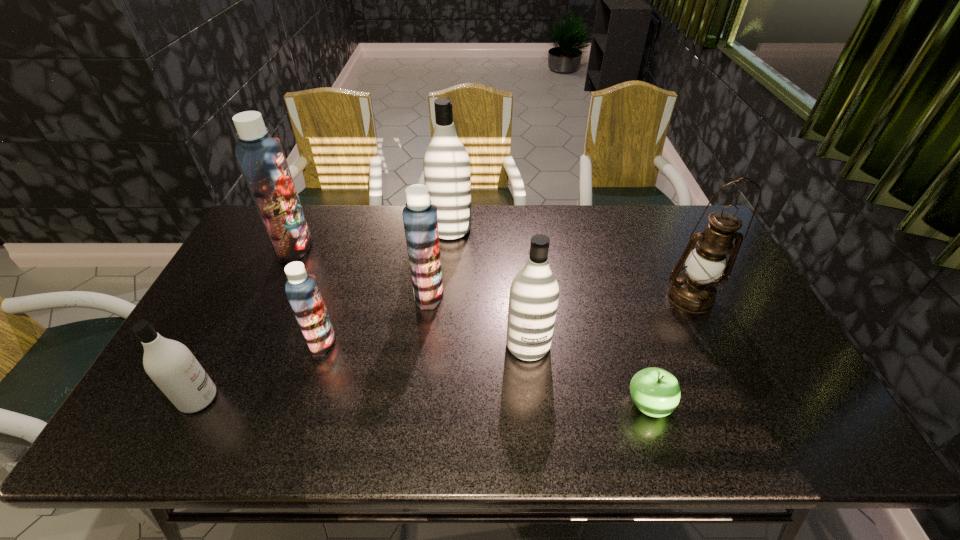
At what (x,y) coordinates should I click in order to perform the action: click on the smallest blue shampoo. Please return your answer as a coordinate pair (x, y). This screenshot has height=540, width=960. Looking at the image, I should click on (302, 290).

The width and height of the screenshot is (960, 540). I want to click on the second blue shampoo from left to right, so click(302, 290).

Where is `the leftmost white shampoo`? Image resolution: width=960 pixels, height=540 pixels. the leftmost white shampoo is located at coordinates (170, 364).

Locate an element on the screen. The image size is (960, 540). the nearest shampoo is located at coordinates (170, 364).

Locate an element on the screen. The width and height of the screenshot is (960, 540). apple is located at coordinates pos(656,392).

Find the location of `the second object from right to left`. the second object from right to left is located at coordinates pos(656,392).

In order to click on vacant space located on the front-facing side of the second white shampoo from right to left in this screenshot , I will do `click(535, 229)`.

What are the coordinates of `free spot located on the front label of the leftmost blue shampoo` in the screenshot? It's located at (432, 247).

Locate an element on the screen. The height and width of the screenshot is (540, 960). free location located 0.080m on the front of the brown oil lamp is located at coordinates (708, 336).

Find the location of a particular element. The image size is (960, 540). vacant area situated on the front label of the second nearest blue shampoo is located at coordinates (544, 294).